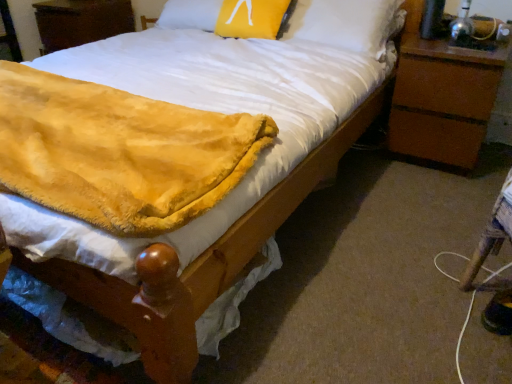
Question: Would you say brown wood nightstand at right, acting as the 1th nightstand starting from the front, is a long distance from wooden nightstand at upper left, positioned as the first nightstand in top-to-bottom order?

Choices:
 (A) yes
 (B) no

Answer: (A)

Question: Is brown wood nightstand at right, marked as the 1th nightstand in a bottom-to-top arrangement, smaller than wooden nightstand at upper left, placed as the second nightstand when sorted from right to left?

Choices:
 (A) yes
 (B) no

Answer: (B)

Question: From a real-world perspective, is brown wood nightstand at right, placed as the second nightstand when sorted from back to front, positioned under wooden nightstand at upper left, the first nightstand in the left-to-right sequence, based on gravity?

Choices:
 (A) no
 (B) yes

Answer: (B)

Question: From a real-world perspective, is brown wood nightstand at right, placed as the second nightstand when sorted from back to front, located higher than wooden nightstand at upper left, placed as the second nightstand when sorted from right to left?

Choices:
 (A) yes
 (B) no

Answer: (B)

Question: Does brown wood nightstand at right, acting as the 1th nightstand starting from the front, turn towards wooden nightstand at upper left, the 1th nightstand viewed from the back?

Choices:
 (A) yes
 (B) no

Answer: (B)

Question: From the image's perspective, is brown wood nightstand at right, which is counted as the second nightstand, starting from the left, over wooden nightstand at upper left, the first nightstand in the left-to-right sequence?

Choices:
 (A) no
 (B) yes

Answer: (A)

Question: Would you say wooden nightstand at upper left, the first nightstand in the left-to-right sequence, is part of yellow fuzzy pillow at upper center's contents?

Choices:
 (A) no
 (B) yes

Answer: (A)

Question: Considering the relative sizes of yellow fuzzy pillow at upper center and wooden nightstand at upper left, placed as the second nightstand when sorted from right to left, in the image provided, is yellow fuzzy pillow at upper center shorter than wooden nightstand at upper left, placed as the second nightstand when sorted from right to left,?

Choices:
 (A) no
 (B) yes

Answer: (B)

Question: From a real-world perspective, is yellow fuzzy pillow at upper center positioned under wooden nightstand at upper left, the second nightstand in the bottom-to-top sequence, based on gravity?

Choices:
 (A) yes
 (B) no

Answer: (B)

Question: Is there a large distance between yellow fuzzy pillow at upper center and wooden nightstand at upper left, the second nightstand in the bottom-to-top sequence?

Choices:
 (A) no
 (B) yes

Answer: (B)

Question: Is yellow fuzzy pillow at upper center to the right of wooden nightstand at upper left, positioned as the first nightstand in top-to-bottom order, from the viewer's perspective?

Choices:
 (A) no
 (B) yes

Answer: (B)

Question: From the image's perspective, is yellow fuzzy pillow at upper center located beneath wooden nightstand at upper left, placed as the second nightstand when sorted from right to left?

Choices:
 (A) yes
 (B) no

Answer: (A)

Question: From the image's perspective, is brown wood nightstand at right, acting as the 1th nightstand starting from the front, located beneath fuzzy yellow blanket at lower left?

Choices:
 (A) yes
 (B) no

Answer: (B)